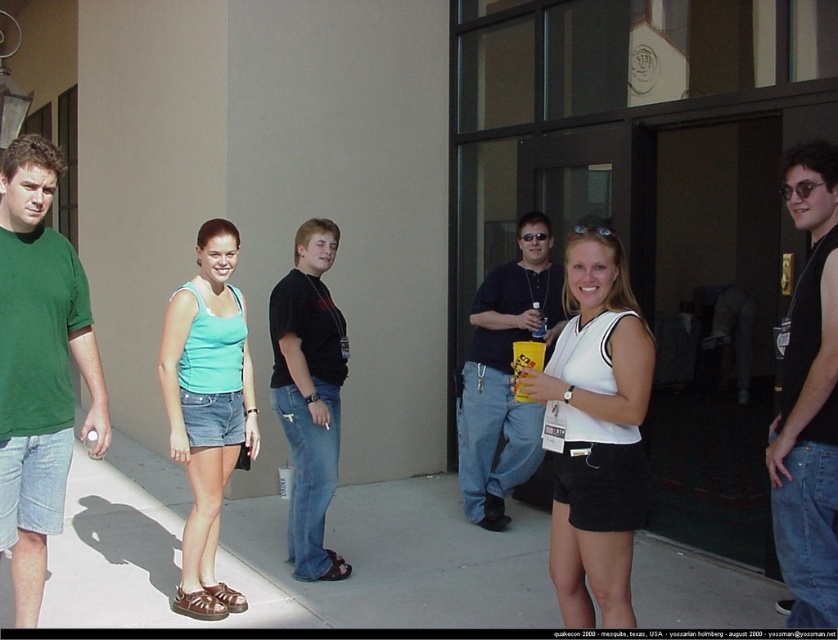
Between smooth concrete pavement at center and white matte tank top at center, which one is positioned lower?

smooth concrete pavement at center is below.

Does smooth concrete pavement at center have a greater height compared to white matte tank top at center?

No.

The image size is (838, 640). What are the coordinates of `smooth concrete pavement at center` in the screenshot? It's located at (283, 554).

The height and width of the screenshot is (640, 838). What do you see at coordinates (283, 554) in the screenshot?
I see `smooth concrete pavement at center` at bounding box center [283, 554].

Between smooth concrete pavement at center and black sleeveless shirt at center, which one appears on the left side from the viewer's perspective?

Positioned to the left is smooth concrete pavement at center.

Locate an element on the screen. The width and height of the screenshot is (838, 640). smooth concrete pavement at center is located at coordinates (283, 554).

Where is `smooth concrete pavement at center`? This screenshot has width=838, height=640. smooth concrete pavement at center is located at coordinates (283, 554).

Can you confirm if teal fabric tank top at center is bigger than black cotton shirt at center?

No, teal fabric tank top at center is not bigger than black cotton shirt at center.

Who is positioned more to the right, teal fabric tank top at center or black cotton shirt at center?

From the viewer's perspective, black cotton shirt at center appears more on the right side.

Identify the location of teal fabric tank top at center. This screenshot has width=838, height=640. (207, 408).